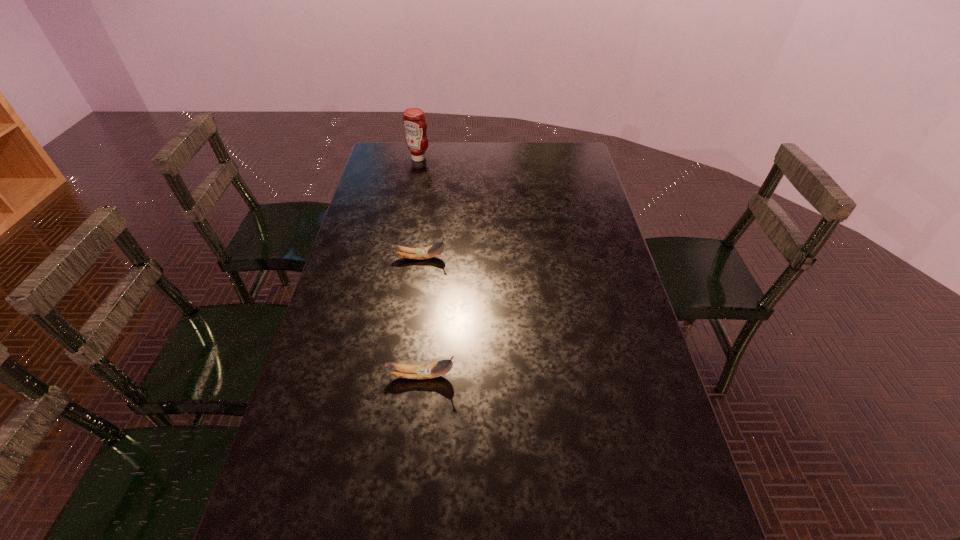
This screenshot has height=540, width=960. I want to click on the tallest object, so (x=414, y=121).

At what (x,y) coordinates should I click in order to perform the action: click on the farthest object. Please return your answer as a coordinate pair (x, y). This screenshot has height=540, width=960. Looking at the image, I should click on (414, 121).

You are a GUI agent. You are given a task and a screenshot of the screen. Output one action in this format:
    pyautogui.click(x=<x>, y=<y>)
    Task: Click on the second nearest object
    
    Given the screenshot: What is the action you would take?
    427,252

Where is `the nearest object`? This screenshot has width=960, height=540. the nearest object is located at coordinates (431, 370).

Locate an element on the screen. free space located 0.120m on the right of the condiment is located at coordinates (459, 158).

What are the coordinates of `vacant area situated at the stem of the farther banana` in the screenshot? It's located at (496, 258).

The height and width of the screenshot is (540, 960). Find the location of `free space located 0.120m on the peel of the nearer banana`. free space located 0.120m on the peel of the nearer banana is located at coordinates (503, 376).

The width and height of the screenshot is (960, 540). What are the coordinates of `object at the far edge` in the screenshot? It's located at (414, 121).

At what (x,y) coordinates should I click in order to perform the action: click on object that is at the left edge. Please return your answer as a coordinate pair (x, y). Image resolution: width=960 pixels, height=540 pixels. Looking at the image, I should click on (414, 121).

At what (x,y) coordinates should I click in order to perform the action: click on object situated at the far left corner. Please return your answer as a coordinate pair (x, y). Looking at the image, I should click on (414, 121).